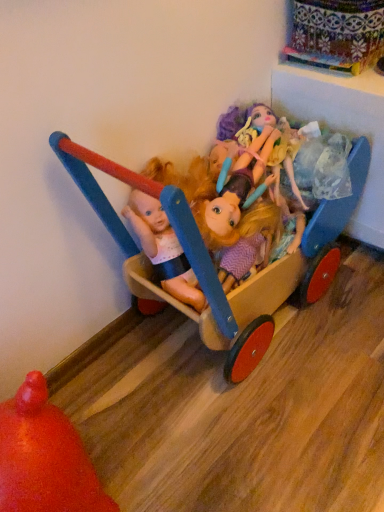
Question: Do you think matte plastic dolls at center is within rubberized orange ball at lower left, which is the second toy from right to left, or outside of it?

Choices:
 (A) inside
 (B) outside

Answer: (B)

Question: Looking at the image, does matte plastic dolls at center seem bigger or smaller compared to rubberized orange ball at lower left, which is the first toy from left to right?

Choices:
 (A) big
 (B) small

Answer: (B)

Question: Based on their relative distances, which object is farther from the rubberized orange ball at lower left, which is the second toy from right to left?

Choices:
 (A) matte plastic dolls at center
 (B) wooden cart at center, marked as the first toy in a right-to-left arrangement

Answer: (A)

Question: Which is nearer to the matte plastic dolls at center?

Choices:
 (A) wooden cart at center, which appears as the second toy when viewed from the left
 (B) rubberized orange ball at lower left, which is the second toy from right to left

Answer: (A)